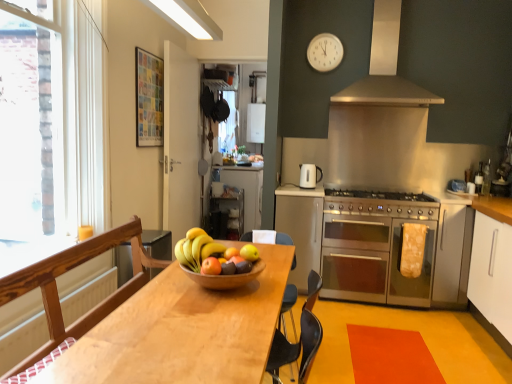
This screenshot has height=384, width=512. Identify the location of empty space that is ontop of wooden bowl of fruit at center (from a real-world perspective). (223, 254).